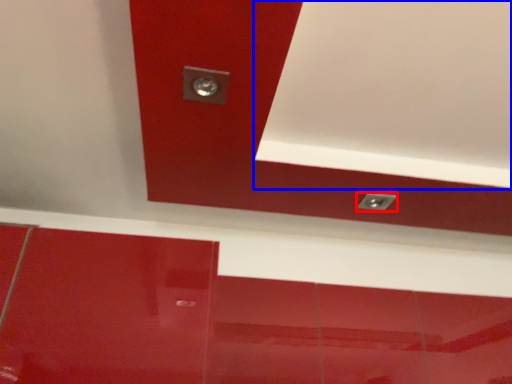
Question: Which point is further to the camera, knob (highlighted by a red box) or exhaust hood (highlighted by a blue box)?

Choices:
 (A) knob
 (B) exhaust hood

Answer: (A)